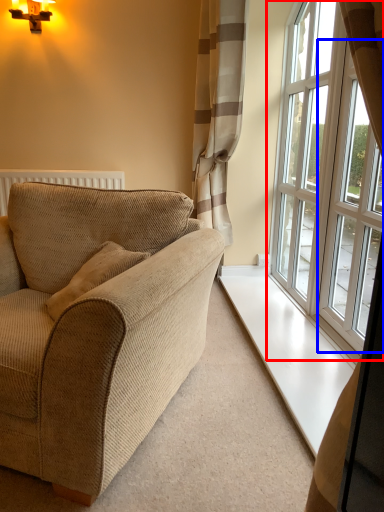
Question: Among these objects, which one is farthest to the camera, window (highlighted by a red box) or window (highlighted by a blue box)?

Choices:
 (A) window
 (B) window

Answer: (A)